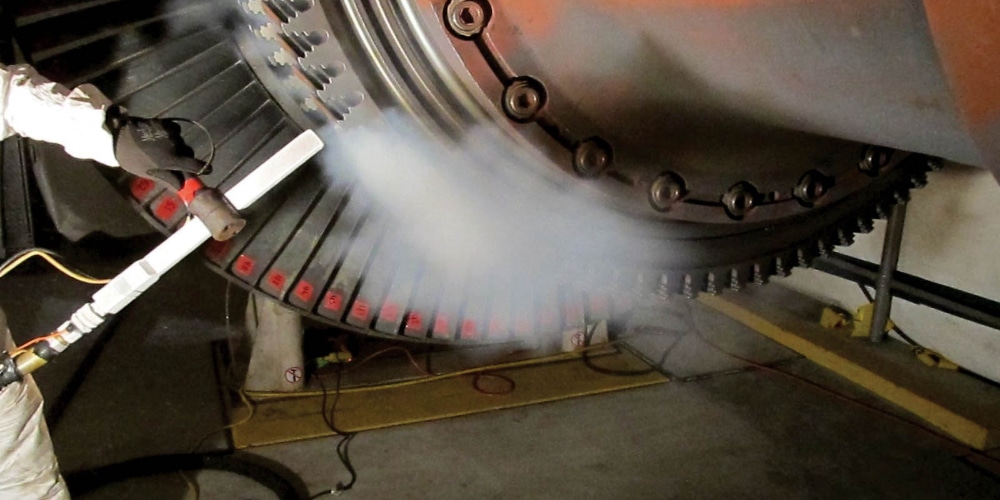
This screenshot has height=500, width=1000. In order to click on cords in this screenshot , I will do `click(13, 253)`, `click(16, 262)`, `click(204, 152)`, `click(247, 415)`, `click(341, 446)`, `click(403, 363)`, `click(494, 393)`, `click(619, 377)`, `click(735, 355)`, `click(910, 334)`.